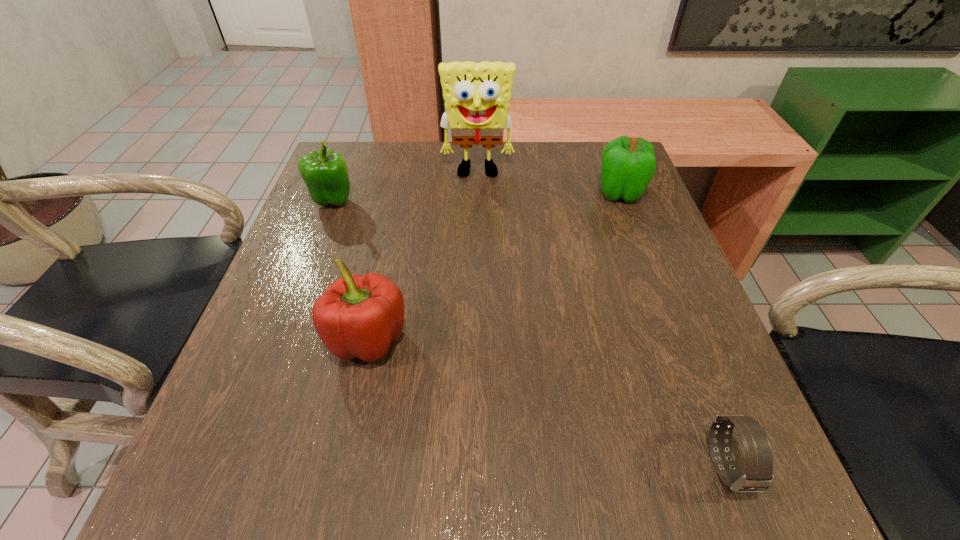
Locate an element on the screen. vacant position at the near edge of the desktop is located at coordinates (542, 460).

The image size is (960, 540). I want to click on free space at the left edge of the desktop, so click(x=311, y=239).

Image resolution: width=960 pixels, height=540 pixels. In the image, there is a desktop. Find the location of `free space at the right edge`. free space at the right edge is located at coordinates (649, 219).

In order to click on vacant space at the far right corner in this screenshot , I will do `click(593, 154)`.

Locate an element on the screen. free space at the near right corner is located at coordinates point(658,453).

Locate an element on the screen. The image size is (960, 540). vacant space that's between the leftmost object and the nearest object is located at coordinates pos(530,333).

What are the coordinates of `unoccupied position between the rightmost bell pepper and the nearest object` in the screenshot? It's located at (673, 329).

Where is `vacant area that lies between the second bell pepper from right to left and the leftmost object`? This screenshot has width=960, height=540. vacant area that lies between the second bell pepper from right to left and the leftmost object is located at coordinates (350, 270).

I want to click on empty space that is in between the leftmost object and the tallest object, so click(405, 187).

This screenshot has height=540, width=960. In order to click on empty space that is in between the leftmost bell pepper and the watch in this screenshot , I will do `click(530, 333)`.